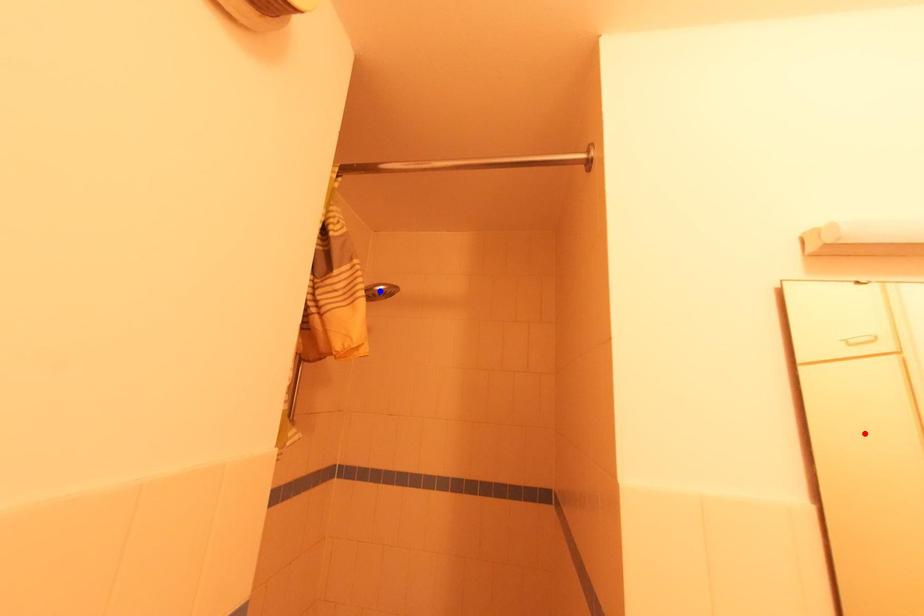
Question: Two points are marked on the image. Which point is closer to the camera?

Choices:
 (A) Blue point is closer.
 (B) Red point is closer.

Answer: (B)